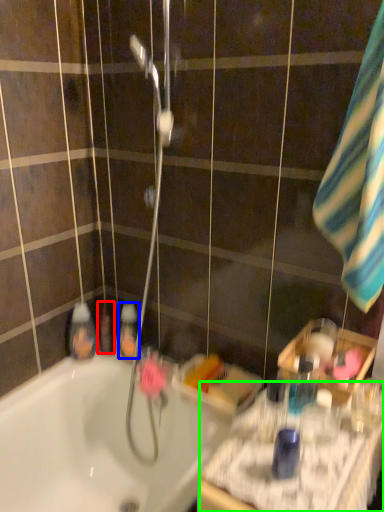
Question: Which object is positioned closest to mouthwash (highlighted by a red box)? Select from mouthwash (highlighted by a blue box) and counter top (highlighted by a green box).

Choices:
 (A) mouthwash
 (B) counter top

Answer: (A)